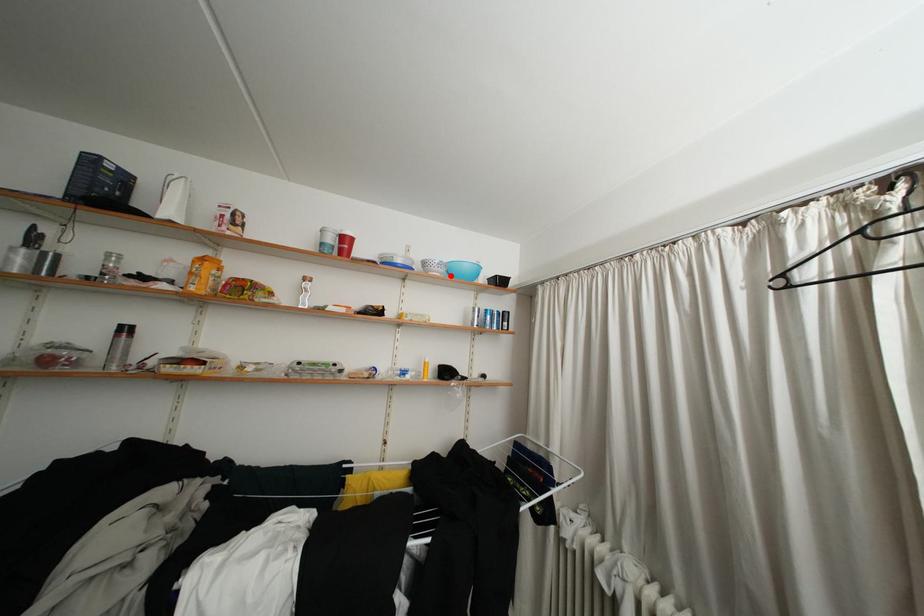
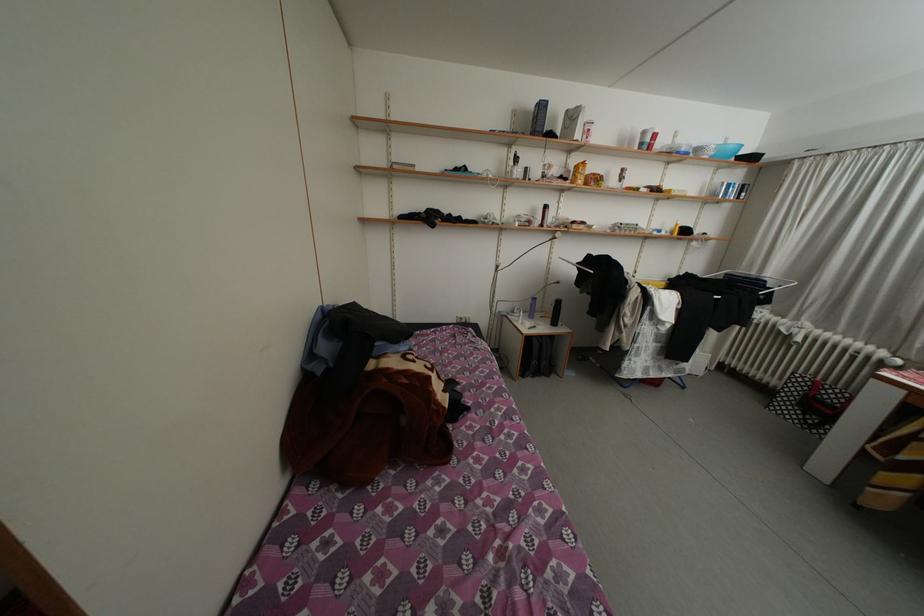
Where in the second image is the point corresponding to the highlighted location from the first image?

(721, 159)